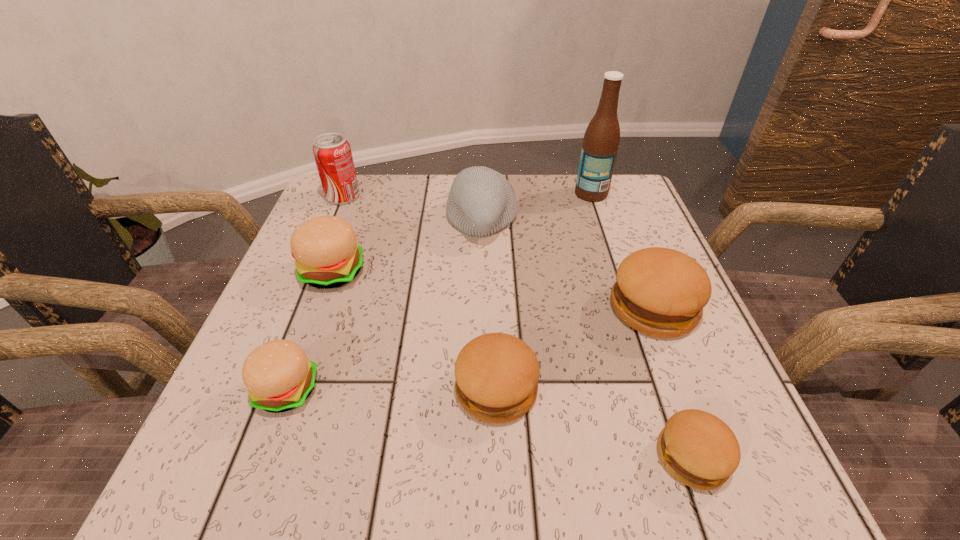
Find the location of a particular element. The width and height of the screenshot is (960, 540). free spot that satisfies the following two spatial constraints: 1. on the front side of the farther beige hamburger; 2. on the right side of the smallest brown hamburger is located at coordinates (266, 457).